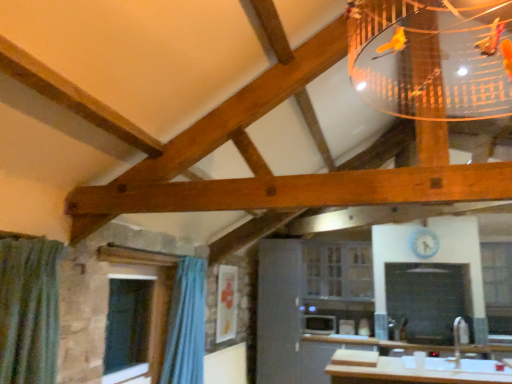
Question: Is blue fabric curtain at lower left positioned in front of clear glass window at lower left, the third window viewed from the back?

Choices:
 (A) yes
 (B) no

Answer: (B)

Question: Does blue fabric curtain at lower left appear on the left side of clear glass window at lower left, which ranks as the first window in front-to-back order?

Choices:
 (A) no
 (B) yes

Answer: (A)

Question: Is clear glass window at lower left, the 3th window in the right-to-left sequence, inside blue fabric curtain at lower left?

Choices:
 (A) no
 (B) yes

Answer: (A)

Question: Is blue fabric curtain at lower left turned away from clear glass window at lower left, the third window viewed from the back?

Choices:
 (A) yes
 (B) no

Answer: (A)

Question: From the image's perspective, is blue fabric curtain at lower left over clear glass window at lower left, which ranks as the first window in front-to-back order?

Choices:
 (A) yes
 (B) no

Answer: (B)

Question: Is clear glass window at lower left, which ranks as the first window in front-to-back order, in front of or behind clear glass window at center, which is the first window in right-to-left order, in the image?

Choices:
 (A) behind
 (B) front

Answer: (B)

Question: Considering the relative positions of clear glass window at lower left, the third window viewed from the back, and clear glass window at center, which is the first window in right-to-left order, in the image provided, is clear glass window at lower left, the third window viewed from the back, to the left or to the right of clear glass window at center, which is the first window in right-to-left order,?

Choices:
 (A) left
 (B) right

Answer: (A)

Question: From a real-world perspective, is clear glass window at lower left, which is the first window from left to right, physically located above or below clear glass window at center, the 2th window when ordered from back to front?

Choices:
 (A) below
 (B) above

Answer: (A)

Question: From the image's perspective, is clear glass window at lower left, which ranks as the first window in front-to-back order, above or below clear glass window at center, acting as the 2th window starting from the front?

Choices:
 (A) below
 (B) above

Answer: (A)

Question: Is clear glass window at lower left, the third window viewed from the back, taller or shorter than white glossy microwave at center?

Choices:
 (A) tall
 (B) short

Answer: (A)

Question: From the image's perspective, is clear glass window at lower left, which is the first window from left to right, above or below white glossy microwave at center?

Choices:
 (A) above
 (B) below

Answer: (A)

Question: Is clear glass window at lower left, which is the first window from left to right, in front of or behind white glossy microwave at center in the image?

Choices:
 (A) front
 (B) behind

Answer: (A)

Question: Would you say clear glass window at lower left, which ranks as the first window in front-to-back order, is to the left or to the right of white glossy microwave at center in the picture?

Choices:
 (A) left
 (B) right

Answer: (A)

Question: From a real-world perspective, is clear glass cabinet at center, which appears as the 2th window when viewed from the left, physically located above or below clear glass window at center, the 2th window when ordered from back to front?

Choices:
 (A) above
 (B) below

Answer: (B)

Question: Is clear glass cabinet at center, which appears as the 2th window when viewed from the left, bigger or smaller than clear glass window at center, the 2th window when ordered from back to front?

Choices:
 (A) small
 (B) big

Answer: (B)